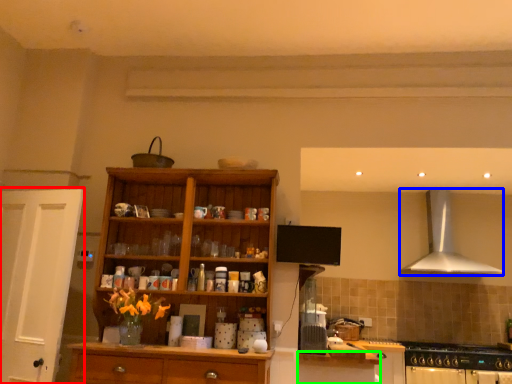
Question: Estimate the real-world distances between objects in this image. Which object is farther from door (highlighted by a red box), kitchen appliance (highlighted by a blue box) or cabinetry (highlighted by a green box)?

Choices:
 (A) kitchen appliance
 (B) cabinetry

Answer: (A)